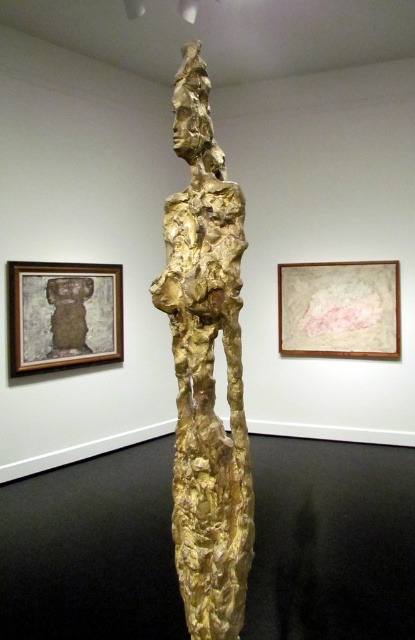
Question: Among these points, which one is nearest to the camera?

Choices:
 (A) (92, 291)
 (B) (300, 276)
 (C) (217, 554)

Answer: (C)

Question: Does wooden framed artwork at upper left have a lesser width compared to matte pink paper at upper center?

Choices:
 (A) yes
 (B) no

Answer: (A)

Question: Which point is closer to the camera?

Choices:
 (A) (90, 337)
 (B) (244, 598)
 (C) (368, 316)

Answer: (B)

Question: Which point is closer to the camera taking this photo?

Choices:
 (A) (221, 458)
 (B) (368, 355)
 (C) (48, 369)

Answer: (A)

Question: From the image, what is the correct spatial relationship of gold textured sculpture at center in relation to matte pink paper at upper center?

Choices:
 (A) right
 (B) left

Answer: (B)

Question: Observing the image, what is the correct spatial positioning of gold textured sculpture at center in reference to wooden framed artwork at upper left?

Choices:
 (A) above
 (B) below

Answer: (B)